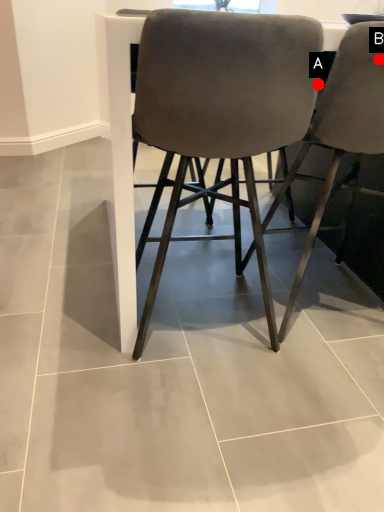
Question: Two points are circled on the image, labeled by A and B beside each circle. Which point is further to the camera?

Choices:
 (A) A is further
 (B) B is further

Answer: (A)